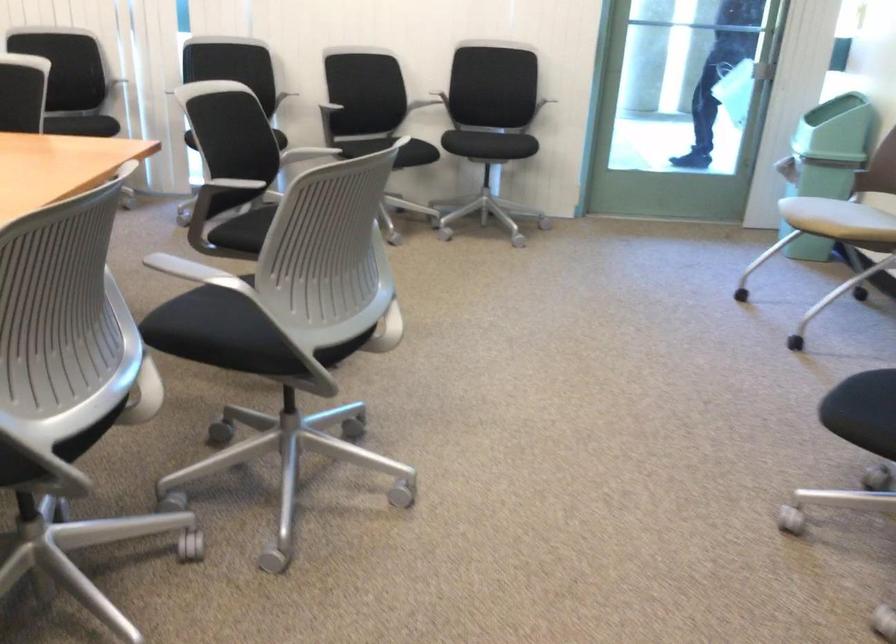
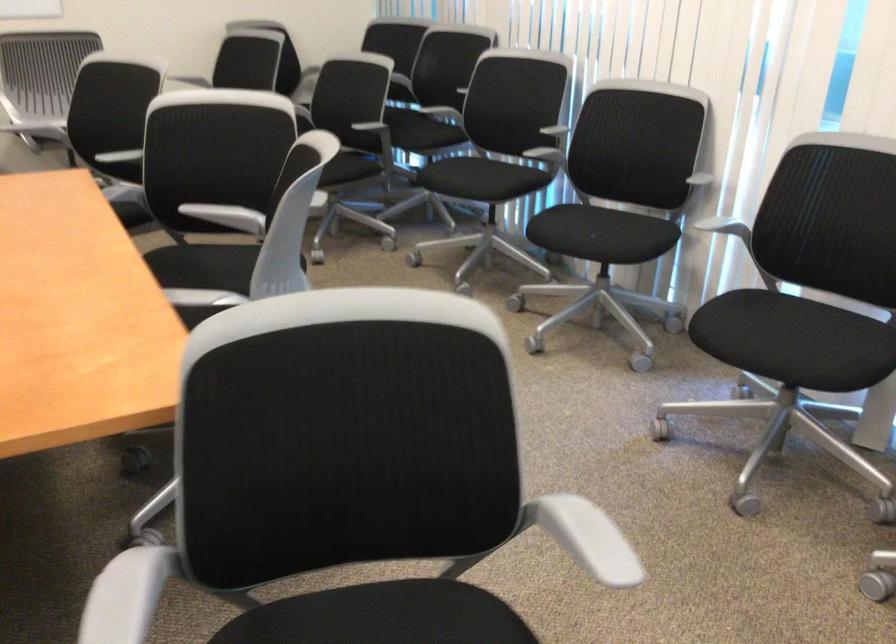
The point at (76, 111) is marked in the first image. Where is the corresponding point in the second image?

(582, 232)